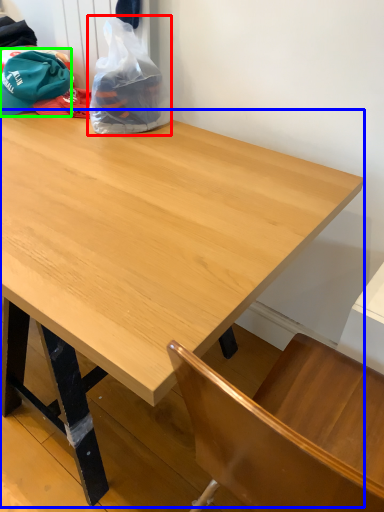
Question: Estimate the real-world distances between objects in this image. Which object is closer to plastic bag (highlighted by a red box), table (highlighted by a blue box) or baseball hat (highlighted by a green box)?

Choices:
 (A) table
 (B) baseball hat

Answer: (B)